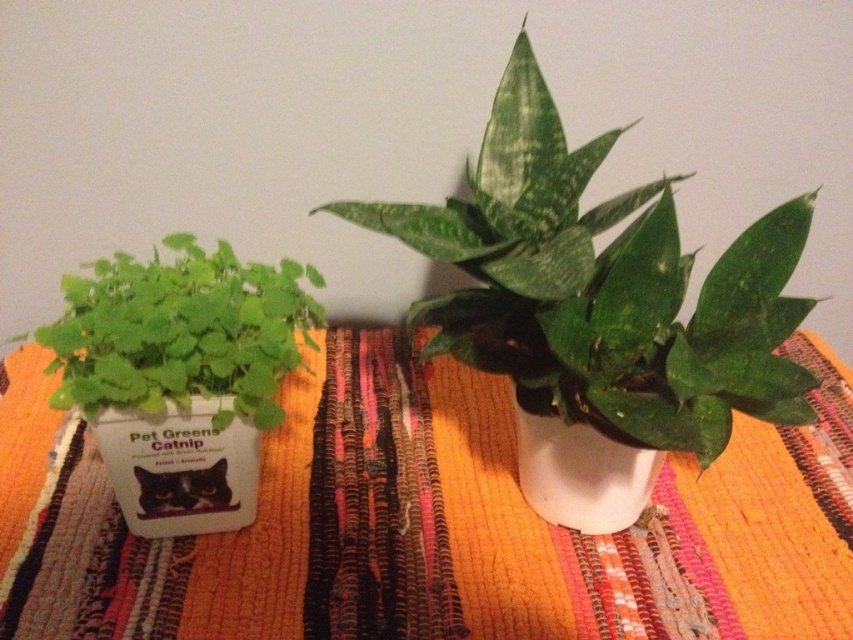
Who is shorter, orange woven rug at center or white matte vase at center?

white matte vase at center

Between orange woven rug at center and white matte vase at center, which one appears on the right side from the viewer's perspective?

Positioned to the right is white matte vase at center.

Locate an element on the screen. The image size is (853, 640). orange woven rug at center is located at coordinates (426, 524).

From the picture: Is orange woven rug at center taller than green matte plant at center?

In fact, orange woven rug at center may be shorter than green matte plant at center.

Find the location of `orange woven rug at center`. orange woven rug at center is located at coordinates [426, 524].

Who is more distant from viewer, (x=239, y=362) or (x=224, y=448)?

Positioned behind is point (x=224, y=448).

Between green matte catnip at left and white matte container at left, which one appears on the left side from the viewer's perspective?

white matte container at left is more to the left.

Which is in front, point (78, 278) or point (149, 440)?

Point (78, 278) is more forward.

Find the location of a particular element. This screenshot has height=640, width=853. green matte catnip at left is located at coordinates (180, 332).